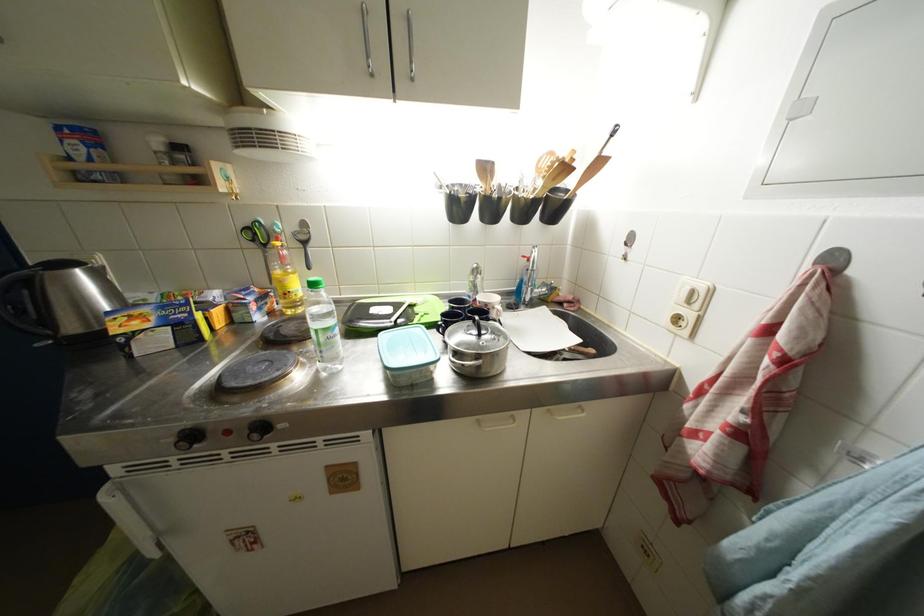
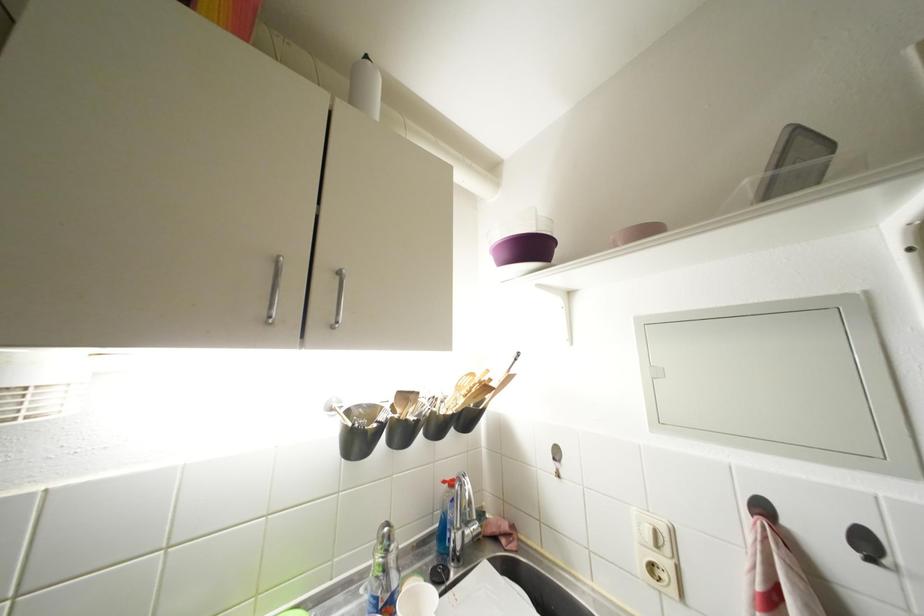
Locate, in the second image, the point that corresponds to [696,306] in the first image.

(663, 549)